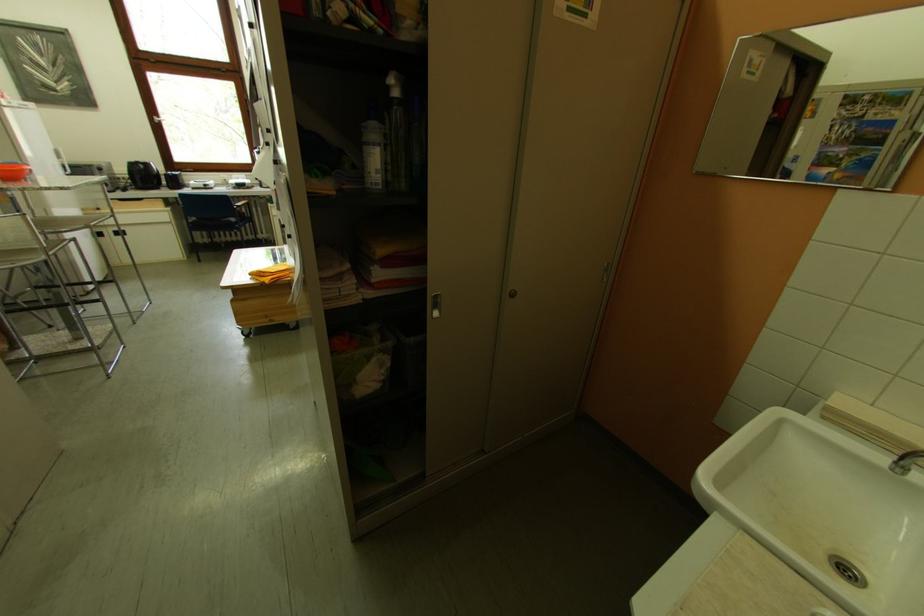
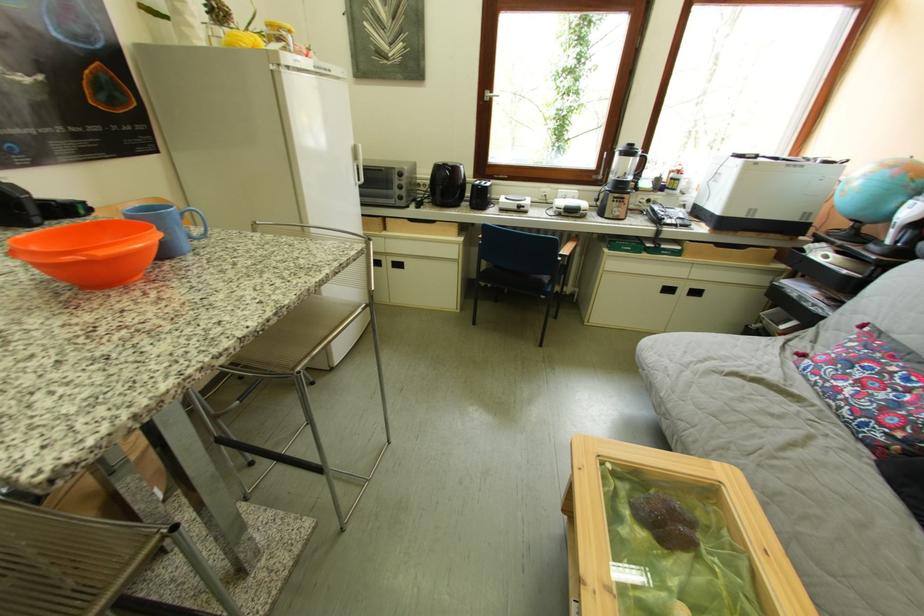
Find the pixel in the second image that matches [128,204] in the first image.

(419, 223)